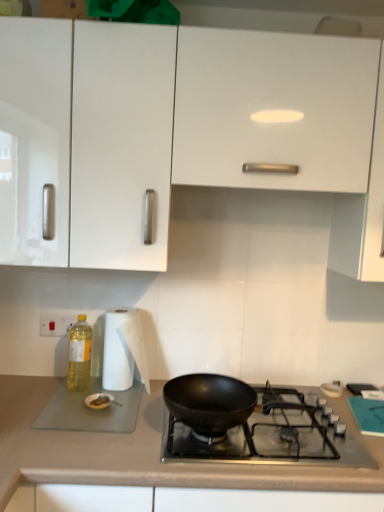
Question: Is point (72, 382) closer or farther from the camera than point (180, 390)?

Choices:
 (A) farther
 (B) closer

Answer: (A)

Question: Do you think yellow translucent bottle at left is within black matte wok at center, or outside of it?

Choices:
 (A) inside
 (B) outside

Answer: (B)

Question: Based on their relative distances, which object is nearer to the yellow translucent bottle at left?

Choices:
 (A) black matte wok at center
 (B) smooth beige countertop at lower center
 (C) black matte wok at center
 (D) white glossy cabinet at upper center
 (E) white plastic electric outlet at lower left

Answer: (E)

Question: Which is nearer to the black matte wok at center?

Choices:
 (A) smooth beige countertop at lower center
 (B) black matte wok at center
 (C) white glossy cabinet at upper center
 (D) white paper towel at left
 (E) yellow translucent bottle at left

Answer: (B)